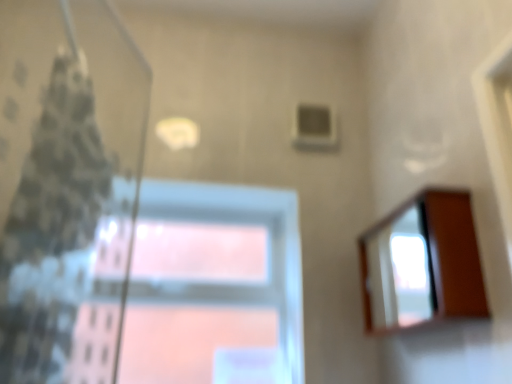
Question: Is patterned fabric shower curtain at left shorter than transparent glass window at center?

Choices:
 (A) no
 (B) yes

Answer: (A)

Question: From the image's perspective, is patterned fabric shower curtain at left beneath transparent glass window at center?

Choices:
 (A) yes
 (B) no

Answer: (B)

Question: Considering the relative sizes of patterned fabric shower curtain at left and transparent glass window at center in the image provided, is patterned fabric shower curtain at left taller than transparent glass window at center?

Choices:
 (A) yes
 (B) no

Answer: (A)

Question: Considering the relative sizes of patterned fabric shower curtain at left and transparent glass window at center in the image provided, is patterned fabric shower curtain at left smaller than transparent glass window at center?

Choices:
 (A) no
 (B) yes

Answer: (A)

Question: Is transparent glass window at center inside patterned fabric shower curtain at left?

Choices:
 (A) yes
 (B) no

Answer: (B)

Question: Is wooden mirror at right taller or shorter than transparent glass window at center?

Choices:
 (A) tall
 (B) short

Answer: (B)

Question: In terms of width, does wooden mirror at right look wider or thinner when compared to transparent glass window at center?

Choices:
 (A) thin
 (B) wide

Answer: (B)

Question: Is point (460, 269) closer or farther from the camera than point (289, 322)?

Choices:
 (A) closer
 (B) farther

Answer: (A)

Question: Considering their positions, is wooden mirror at right located in front of or behind transparent glass window at center?

Choices:
 (A) front
 (B) behind

Answer: (A)

Question: From the image's perspective, is patterned fabric shower curtain at left positioned above or below wooden mirror at right?

Choices:
 (A) below
 (B) above

Answer: (B)

Question: Is patterned fabric shower curtain at left taller or shorter than wooden mirror at right?

Choices:
 (A) short
 (B) tall

Answer: (B)

Question: From a real-world perspective, is patterned fabric shower curtain at left positioned above or below wooden mirror at right?

Choices:
 (A) above
 (B) below

Answer: (A)

Question: In terms of size, does patterned fabric shower curtain at left appear bigger or smaller than wooden mirror at right?

Choices:
 (A) small
 (B) big

Answer: (B)

Question: Looking at their shapes, would you say wooden mirror at right is wider or thinner than patterned fabric shower curtain at left?

Choices:
 (A) wide
 (B) thin

Answer: (B)

Question: Based on their sizes in the image, would you say wooden mirror at right is bigger or smaller than patterned fabric shower curtain at left?

Choices:
 (A) small
 (B) big

Answer: (A)